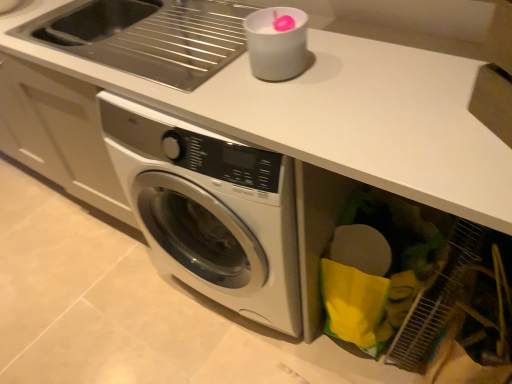
This screenshot has width=512, height=384. I want to click on blank space to the left of white plastic cup at upper center, so click(x=208, y=76).